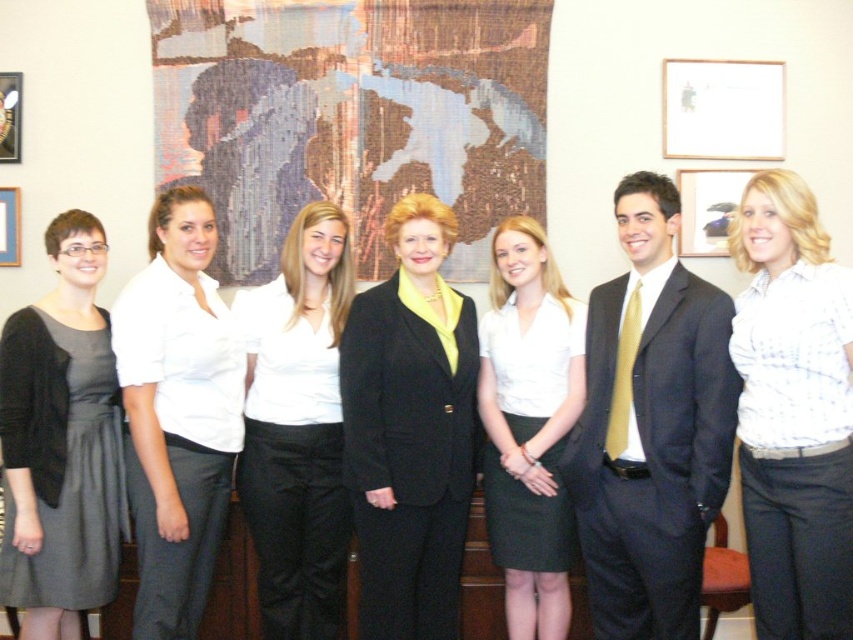
You are standing in the office scene described. You need to locate the white cotton shirt at center. According to the coordinates given, where exactly is it positioned?

The white cotton shirt at center is positioned at coordinates point (177,412).

You are a photographer setting up for a group photo. You need to ensure that the matte black suit at center and the white smooth shirt at center are at least 36 inches apart for better visibility. Based on the current setup, can you confirm if they meet this requirement?

The matte black suit at center and white smooth shirt at center are currently 34.24 inches apart, which is less than the required 36 inches. Therefore, they do not meet the requirement and need to be moved further apart.

You are standing in the office scene described. There is a point marked at coordinates (651, 426). What object is located at that point?

The object at point (651, 426) is the matte black suit at center.